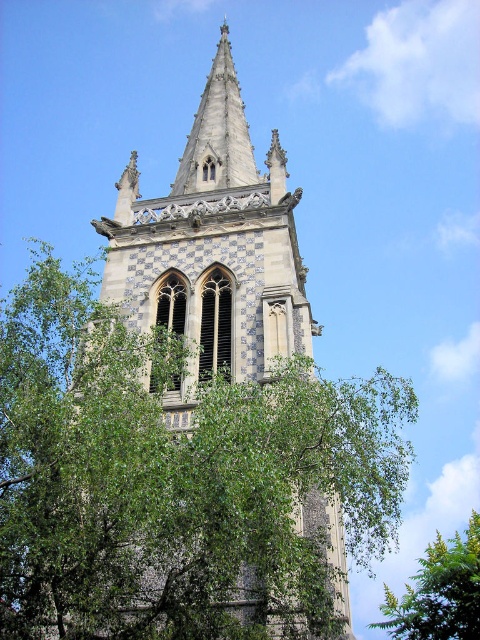
You are standing in a park and see the white checkered stone tower at center and the green leafy tree at lower right. Which object is taller?

The white checkered stone tower at center is taller than the green leafy tree at lower right according to the description.

You are standing at the entrance of the church and want to take a photo of the white checkered stone tower at center. Based on its position, which direction should you face to ensure the tower is centered in your camera view?

The white checkered stone tower at center is located at point coordinates, so you should face directly towards the center of the scene to capture it in your photo.

You are a drone operator tasked with flying a drone from the green leafy tree at lower right to the white checkered stone tower at center. The drone has a maximum flight range of 45 meters. Can the drone successfully reach the tower?

The distance between the green leafy tree at lower right and the white checkered stone tower at center is 46.75 meters. Since the drone can only fly up to 45 meters, it cannot reach the tower without recharging or refueling.